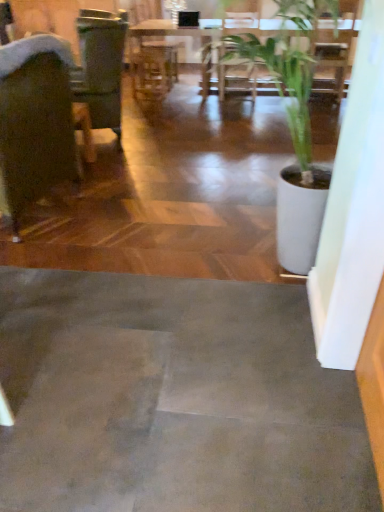
Question: Could you tell me if green leafy plant at upper center is facing dark brown leather chair at left?

Choices:
 (A) yes
 (B) no

Answer: (A)

Question: From the image's perspective, is green leafy plant at upper center located beneath dark brown leather chair at left?

Choices:
 (A) yes
 (B) no

Answer: (B)

Question: Considering the relative positions of green leafy plant at upper center and dark brown leather chair at left in the image provided, is green leafy plant at upper center in front of dark brown leather chair at left?

Choices:
 (A) no
 (B) yes

Answer: (A)

Question: Does green leafy plant at upper center contain dark brown leather chair at left?

Choices:
 (A) yes
 (B) no

Answer: (B)

Question: From the image's perspective, is green leafy plant at upper center located above dark brown leather chair at left?

Choices:
 (A) no
 (B) yes

Answer: (B)

Question: Does green leafy plant at upper center lie behind dark brown leather chair at left?

Choices:
 (A) yes
 (B) no

Answer: (A)

Question: Is dark brown leather chair at left completely or partially outside of green leafy plant at upper center?

Choices:
 (A) yes
 (B) no

Answer: (A)

Question: Is there a large distance between dark brown leather chair at left and green leafy plant at upper center?

Choices:
 (A) no
 (B) yes

Answer: (B)

Question: Is dark brown leather chair at left turned away from green leafy plant at upper center?

Choices:
 (A) yes
 (B) no

Answer: (B)

Question: From the image's perspective, is dark brown leather chair at left located above green leafy plant at upper center?

Choices:
 (A) no
 (B) yes

Answer: (A)

Question: Considering the relative sizes of dark brown leather chair at left and green leafy plant at upper center in the image provided, is dark brown leather chair at left taller than green leafy plant at upper center?

Choices:
 (A) no
 (B) yes

Answer: (B)

Question: Considering the relative sizes of dark brown leather chair at left and green leafy plant at upper center in the image provided, is dark brown leather chair at left thinner than green leafy plant at upper center?

Choices:
 (A) no
 (B) yes

Answer: (B)

Question: Do you think green leafy plant at upper center is within dark brown leather chair at left, or outside of it?

Choices:
 (A) inside
 (B) outside

Answer: (B)